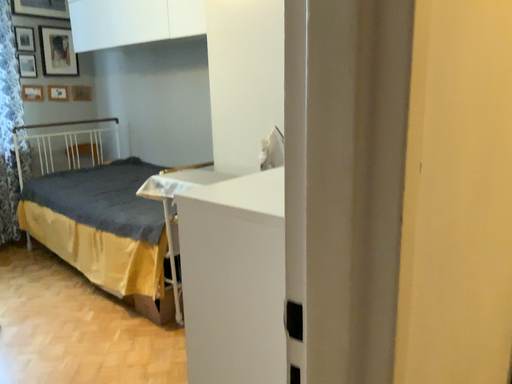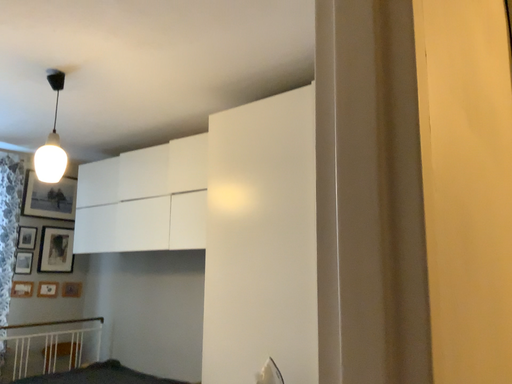
Question: How did the camera likely rotate when shooting the video?

Choices:
 (A) rotated upward
 (B) rotated downward

Answer: (A)